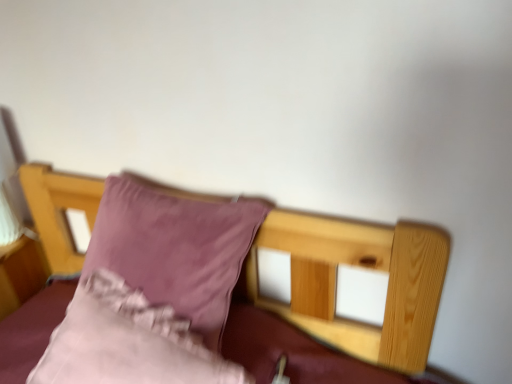
Question: Which direction should I rotate to look at velvet pink pillow at center, positioned as the 1th pillow in top-to-bottom order?

Choices:
 (A) right
 (B) left

Answer: (B)

Question: Is pink satin pillow at center, which is the 1th pillow from bottom to top, not inside velvet pink pillow at center, positioned as the 1th pillow in top-to-bottom order?

Choices:
 (A) yes
 (B) no

Answer: (A)

Question: Can you confirm if pink satin pillow at center, which is the 1th pillow from bottom to top, is taller than velvet pink pillow at center, positioned as the 1th pillow in top-to-bottom order?

Choices:
 (A) no
 (B) yes

Answer: (A)

Question: Considering the relative sizes of pink satin pillow at center, acting as the 2th pillow starting from the top, and velvet pink pillow at center, positioned as the 1th pillow in top-to-bottom order, in the image provided, is pink satin pillow at center, acting as the 2th pillow starting from the top, smaller than velvet pink pillow at center, positioned as the 1th pillow in top-to-bottom order,?

Choices:
 (A) yes
 (B) no

Answer: (A)

Question: From the image's perspective, is pink satin pillow at center, acting as the 2th pillow starting from the top, located beneath velvet pink pillow at center, which is the 2th pillow from bottom to top?

Choices:
 (A) no
 (B) yes

Answer: (B)

Question: Considering the relative sizes of pink satin pillow at center, which is the 1th pillow from bottom to top, and velvet pink pillow at center, positioned as the 1th pillow in top-to-bottom order, in the image provided, is pink satin pillow at center, which is the 1th pillow from bottom to top, wider than velvet pink pillow at center, positioned as the 1th pillow in top-to-bottom order,?

Choices:
 (A) yes
 (B) no

Answer: (B)

Question: Considering the relative positions of pink satin pillow at center, acting as the 2th pillow starting from the top, and velvet pink pillow at center, which is the 2th pillow from bottom to top, in the image provided, is pink satin pillow at center, acting as the 2th pillow starting from the top, to the left of velvet pink pillow at center, which is the 2th pillow from bottom to top, from the viewer's perspective?

Choices:
 (A) no
 (B) yes

Answer: (B)

Question: Can we say velvet pink pillow at center, which is the 2th pillow from bottom to top, lies outside pink satin pillow at center, which is the 1th pillow from bottom to top?

Choices:
 (A) no
 (B) yes

Answer: (B)

Question: Is velvet pink pillow at center, which is the 2th pillow from bottom to top, looking in the opposite direction of pink satin pillow at center, acting as the 2th pillow starting from the top?

Choices:
 (A) no
 (B) yes

Answer: (A)

Question: Is velvet pink pillow at center, positioned as the 1th pillow in top-to-bottom order, smaller than pink satin pillow at center, which is the 1th pillow from bottom to top?

Choices:
 (A) no
 (B) yes

Answer: (A)

Question: From a real-world perspective, is velvet pink pillow at center, which is the 2th pillow from bottom to top, below pink satin pillow at center, which is the 1th pillow from bottom to top?

Choices:
 (A) no
 (B) yes

Answer: (A)

Question: Is velvet pink pillow at center, which is the 2th pillow from bottom to top, further to the viewer compared to pink satin pillow at center, acting as the 2th pillow starting from the top?

Choices:
 (A) yes
 (B) no

Answer: (A)

Question: Is velvet pink pillow at center, positioned as the 1th pillow in top-to-bottom order, next to pink satin pillow at center, which is the 1th pillow from bottom to top, and touching it?

Choices:
 (A) no
 (B) yes

Answer: (A)

Question: Is velvet pink pillow at center, positioned as the 1th pillow in top-to-bottom order, taller or shorter than pink satin pillow at center, which is the 1th pillow from bottom to top?

Choices:
 (A) short
 (B) tall

Answer: (B)